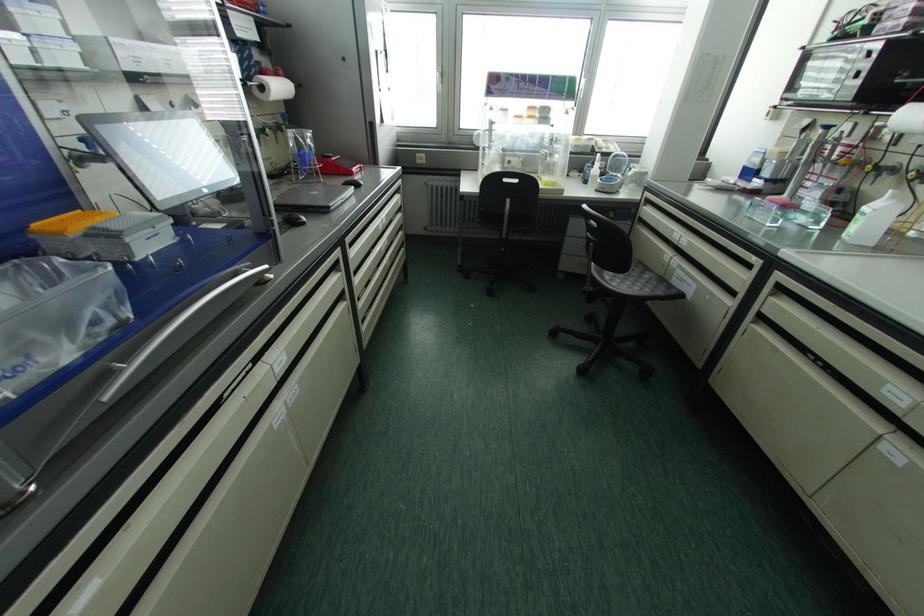
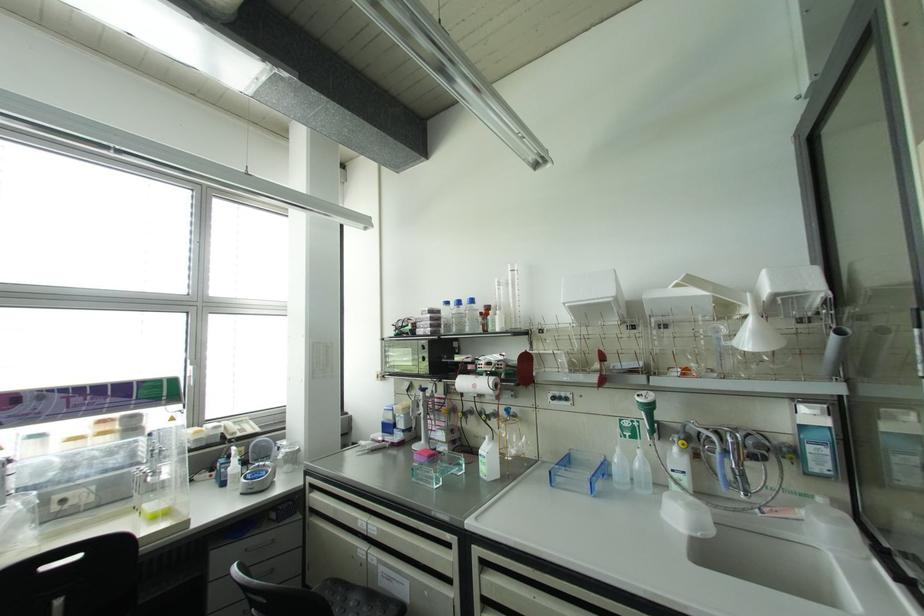
Locate, in the second image, the point that corresponds to point 676,261 in the first image.

(373, 554)